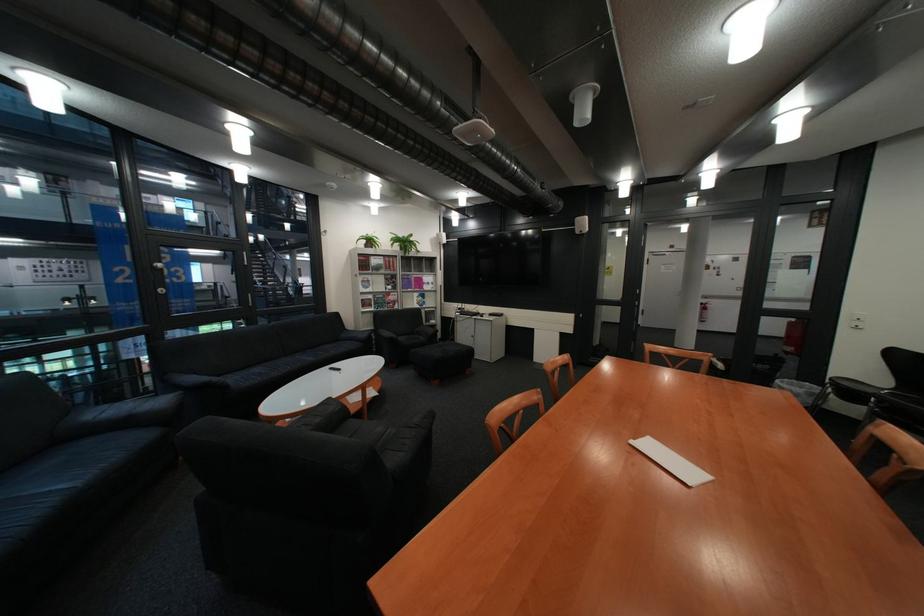
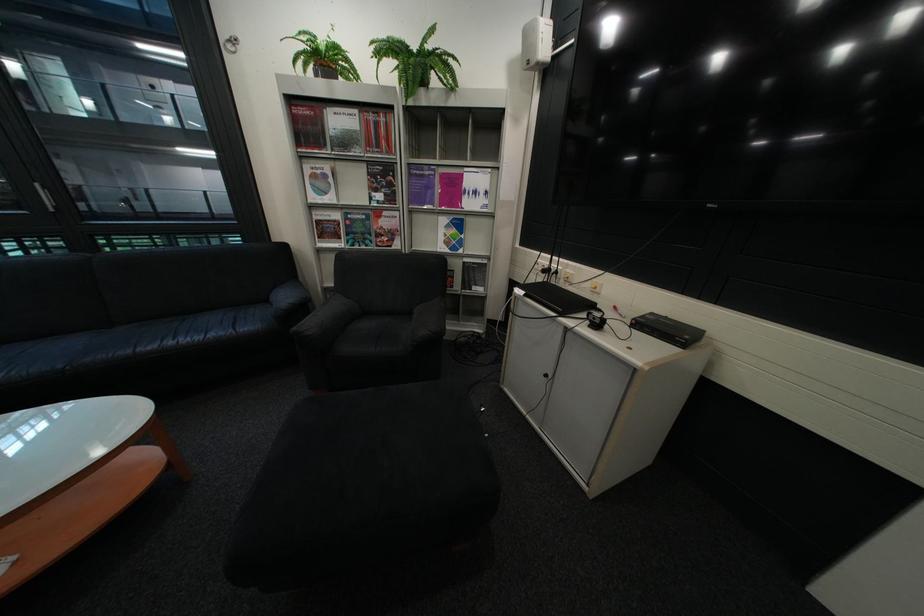
Locate, in the second image, the point that corresponds to (x=442, y=288) in the first image.

(484, 204)